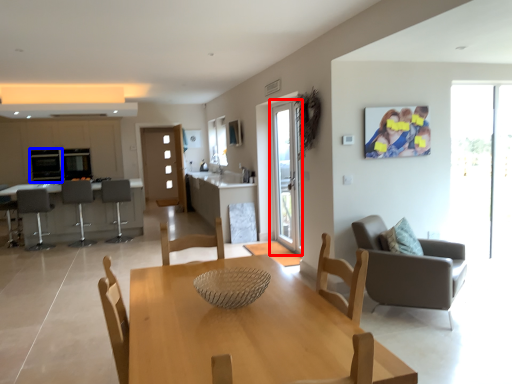
Question: Which object appears closest to the camera in this image, screen door (highlighted by a red box) or appliance (highlighted by a blue box)?

Choices:
 (A) screen door
 (B) appliance

Answer: (A)